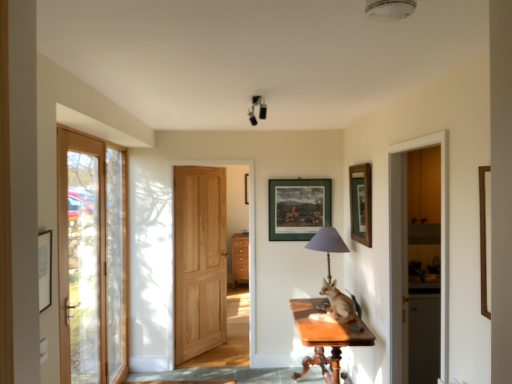
The height and width of the screenshot is (384, 512). What do you see at coordinates (361, 203) in the screenshot?
I see `wooden picture frame at upper right, the first picture frame positioned from the right` at bounding box center [361, 203].

Describe the element at coordinates (230, 375) in the screenshot. I see `smooth stone path at lower center` at that location.

Where is `wooden table at center`? Image resolution: width=512 pixels, height=384 pixels. wooden table at center is located at coordinates (326, 339).

From a real-world perspective, which object stands above the other?

matte gray metal table lamp at center is physically above.

From the image's perspective, which one is positioned higher, wooden table at center or matte gray metal table lamp at center?

matte gray metal table lamp at center.

Identify the location of table lamp located above the wooden table at center (from the image's perspective). (327, 243).

Could you tell me if smooth stone path at lower center is facing wooden picture frame at upper right, positioned as the 1th picture frame in front-to-back order?

No, smooth stone path at lower center is not oriented towards wooden picture frame at upper right, positioned as the 1th picture frame in front-to-back order.

Can you tell me how much smooth stone path at lower center and wooden picture frame at upper right, the first picture frame positioned from the right, differ in facing direction?

The angle between the facing direction of smooth stone path at lower center and the facing direction of wooden picture frame at upper right, the first picture frame positioned from the right, is 88.3 degrees.

Are smooth stone path at lower center and wooden picture frame at upper right, which is the 2th picture frame in back-to-front order, located far from each other?

smooth stone path at lower center is positioned a significant distance from wooden picture frame at upper right, which is the 2th picture frame in back-to-front order.

Does smooth stone path at lower center lie behind light brown fur at center?

Yes, smooth stone path at lower center is further from the viewer.

Can we say smooth stone path at lower center lies outside light brown fur at center?

smooth stone path at lower center lies outside light brown fur at center's area.

Measure the distance from smooth stone path at lower center to light brown fur at center.

smooth stone path at lower center and light brown fur at center are 4.06 feet apart.

Is smooth stone path at lower center at the right side of light brown fur at center?

In fact, smooth stone path at lower center is to the left of light brown fur at center.

This screenshot has width=512, height=384. There is a black matte lamp at upper center. In order to click on the 1st picture frame below it (from a real-world perspective) in this screenshot , I will do `click(361, 203)`.

Would you say wooden picture frame at upper right, which is the 2th picture frame in back-to-front order, is part of black matte lamp at upper center's contents?

Definitely not — wooden picture frame at upper right, which is the 2th picture frame in back-to-front order, is not inside black matte lamp at upper center.

How far apart are black matte lamp at upper center and wooden picture frame at upper right, arranged as the 2th picture frame when viewed from the left?

black matte lamp at upper center is 3.74 feet away from wooden picture frame at upper right, arranged as the 2th picture frame when viewed from the left.

Does wooden picture frame at upper right, positioned as the 1th picture frame in front-to-back order, have a smaller size compared to black matte lamp at upper center?

No.

Is wooden picture frame at upper right, arranged as the 2th picture frame when viewed from the left, facing away from black matte lamp at upper center?

No, wooden picture frame at upper right, arranged as the 2th picture frame when viewed from the left,'s orientation is not away from black matte lamp at upper center.

Measure the distance between wooden picture frame at upper right, arranged as the 2th picture frame when viewed from the left, and black matte lamp at upper center.

They are 3.74 feet apart.

From the image's perspective, count 1st picture frames downward from the black matte lamp at upper center and point to it. Please provide its 2D coordinates.

[(361, 203)]

Considering the relative sizes of clear glass door at left, the second door viewed from the right, and wooden table at center in the image provided, is clear glass door at left, the second door viewed from the right, taller than wooden table at center?

Yes, clear glass door at left, the second door viewed from the right, is taller than wooden table at center.

Does clear glass door at left, the first door in the front-to-back sequence, contain wooden table at center?

No, wooden table at center is not surrounded by clear glass door at left, the first door in the front-to-back sequence.

Between clear glass door at left, the first door in the front-to-back sequence, and wooden table at center, which one appears on the left side from the viewer's perspective?

clear glass door at left, the first door in the front-to-back sequence.

Is clear glass door at left, placed as the first door when sorted from left to right, oriented away from wooden table at center?

No, wooden table at center is not at the back of clear glass door at left, placed as the first door when sorted from left to right.

How far apart are clear glass door at left, the second door viewed from the right, and green matte picture frame at center, marked as the 2th picture frame in a front-to-back arrangement?

clear glass door at left, the second door viewed from the right, and green matte picture frame at center, marked as the 2th picture frame in a front-to-back arrangement, are 5.52 feet apart.

Is clear glass door at left, marked as the second door in a back-to-front arrangement, oriented away from green matte picture frame at center, which is the first picture frame from back to front?

No, clear glass door at left, marked as the second door in a back-to-front arrangement, is not facing the opposite direction of green matte picture frame at center, which is the first picture frame from back to front.

Is clear glass door at left, the first door in the front-to-back sequence, bigger or smaller than green matte picture frame at center, which is the first picture frame from back to front?

Clearly, clear glass door at left, the first door in the front-to-back sequence, is larger in size than green matte picture frame at center, which is the first picture frame from back to front.

From the image's perspective, is clear glass door at left, the first door in the front-to-back sequence, located beneath green matte picture frame at center, which is the first picture frame from back to front?

Yes.

The width and height of the screenshot is (512, 384). In order to click on table to the left of matte gray metal table lamp at center in this screenshot , I will do `click(326, 339)`.

This screenshot has height=384, width=512. I want to click on picture frame that is in front of the smooth stone path at lower center, so click(x=361, y=203).

Estimate the real-world distances between objects in this image. Which object is further from natural wood door at center, placed as the first door when sorted from back to front, black matte lamp at upper center or clear glass door at left, placed as the first door when sorted from left to right?

Among the two, black matte lamp at upper center is located further to natural wood door at center, placed as the first door when sorted from back to front.

Looking at the image, which one is located closer to black matte lamp at upper center, natural wood door at center, which is counted as the second door, starting from the front, or clear glass door at left, the second door viewed from the right?

natural wood door at center, which is counted as the second door, starting from the front, is closer to black matte lamp at upper center.

Considering their positions, is matte gray metal table lamp at center positioned closer to smooth stone path at lower center than wooden table at center?

wooden table at center.

From the image, which object appears to be farther from wooden picture frame at upper right, arranged as the 2th picture frame when viewed from the left, black matte lamp at upper center or natural wood door at center, which is counted as the second door, starting from the front?

The object further to wooden picture frame at upper right, arranged as the 2th picture frame when viewed from the left, is natural wood door at center, which is counted as the second door, starting from the front.

Looking at the image, which one is located closer to clear glass door at left, the second door viewed from the right, natural wood door at center, the second door viewed from the left, or light brown fur at center?

natural wood door at center, the second door viewed from the left, lies closer to clear glass door at left, the second door viewed from the right, than the other object.

From the image, which object appears to be nearer to clear glass door at left, marked as the second door in a back-to-front arrangement, matte gray metal table lamp at center or wooden picture frame at upper right, which is the 2th picture frame in back-to-front order?

Among the two, matte gray metal table lamp at center is located nearer to clear glass door at left, marked as the second door in a back-to-front arrangement.

Which object lies nearer to the anchor point black matte lamp at upper center, light brown fur at center or clear glass door at left, placed as the first door when sorted from left to right?

The object closer to black matte lamp at upper center is light brown fur at center.

When comparing their distances from matte gray metal table lamp at center, does green matte picture frame at center, the 2th picture frame in the right-to-left sequence, or wooden table at center seem closer?

green matte picture frame at center, the 2th picture frame in the right-to-left sequence, is positioned closer to the anchor matte gray metal table lamp at center.

The width and height of the screenshot is (512, 384). I want to click on path located between clear glass door at left, placed as the first door when sorted from left to right, and wooden table at center in the left-right direction, so click(x=230, y=375).

The width and height of the screenshot is (512, 384). In order to click on picture frame between clear glass door at left, placed as the first door when sorted from left to right, and light brown fur at center, in the horizontal direction in this screenshot , I will do `click(298, 208)`.

I want to click on cat between green matte picture frame at center, which is the 1th picture frame in left-to-right order, and smooth stone path at lower center, in the vertical direction, so click(337, 305).

You are a GUI agent. You are given a task and a screenshot of the screen. Output one action in this format:
    pyautogui.click(x=<x>, y=<y>)
    Task: Click on the table lamp between light brown fur at center and green matte picture frame at center, marked as the 2th picture frame in a front-to-back arrangement, from front to back
    This screenshot has width=512, height=384.
    Given the screenshot: What is the action you would take?
    pyautogui.click(x=327, y=243)